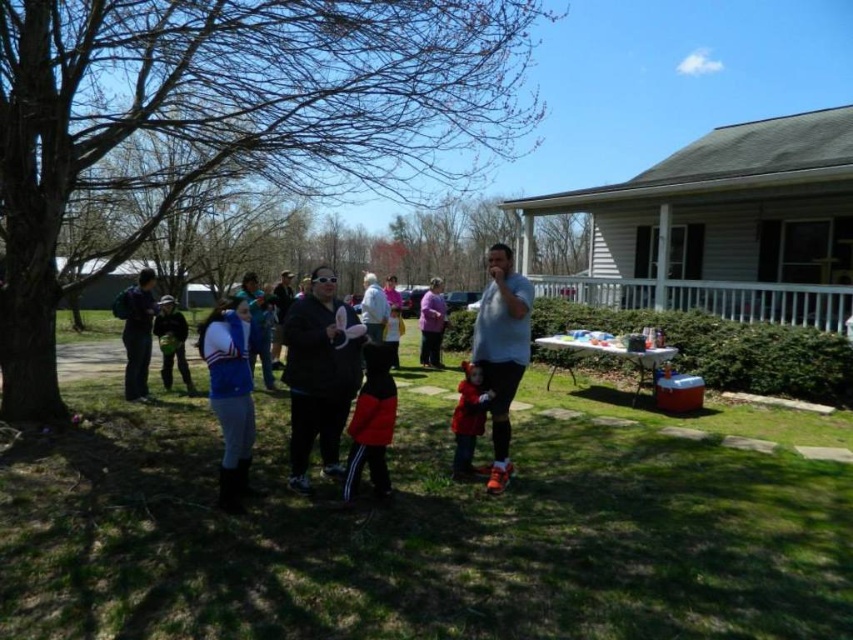
Question: Estimate the real-world distances between objects in this image. Which object is farther from the red fleece jacket at center?

Choices:
 (A) blue fleece jacket at center
 (B) pink fabric jacket at center

Answer: (B)

Question: Is red fleece jacket at center thinner than dark blue jacket at left?

Choices:
 (A) no
 (B) yes

Answer: (B)

Question: Can you confirm if matte red coat at center is positioned below dark blue jacket at center?

Choices:
 (A) no
 (B) yes

Answer: (B)

Question: Which point appears farthest from the camera in this image?

Choices:
 (A) (515, 280)
 (B) (173, 307)
 (C) (143, 388)
 (D) (329, 298)

Answer: (B)

Question: Estimate the real-world distances between objects in this image. Which object is closer to the green grass at center?

Choices:
 (A) matte red coat at center
 (B) black matte jacket at center
 (C) blue fleece jacket at center
 (D) white matte jacket at center

Answer: (C)

Question: Is red fleece jacket at center behind dark blue jacket at left?

Choices:
 (A) no
 (B) yes

Answer: (A)